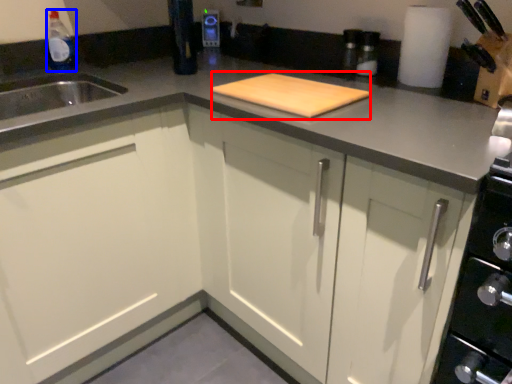
Question: Among these objects, which one is nearest to the camera, cutting board (highlighted by a red box) or bottle (highlighted by a blue box)?

Choices:
 (A) cutting board
 (B) bottle

Answer: (A)